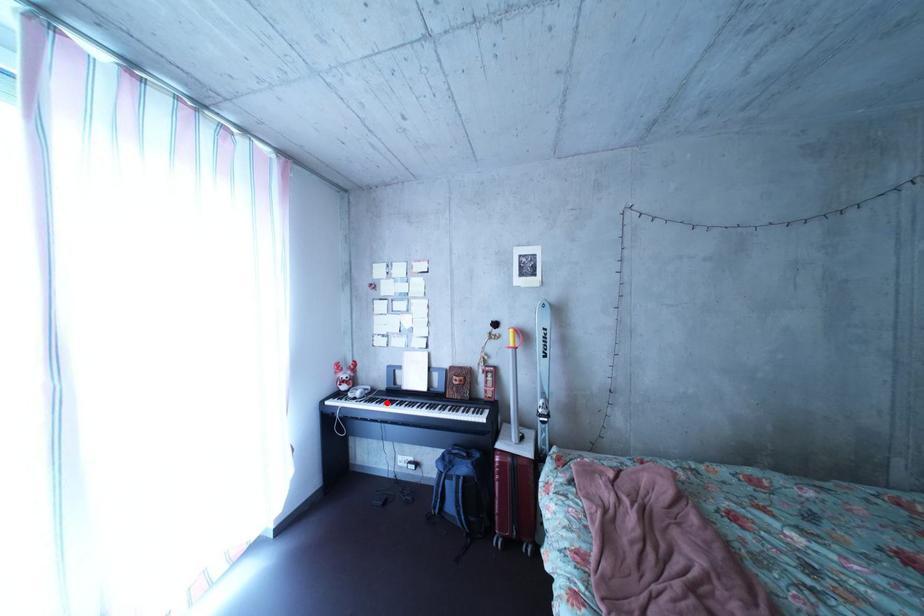
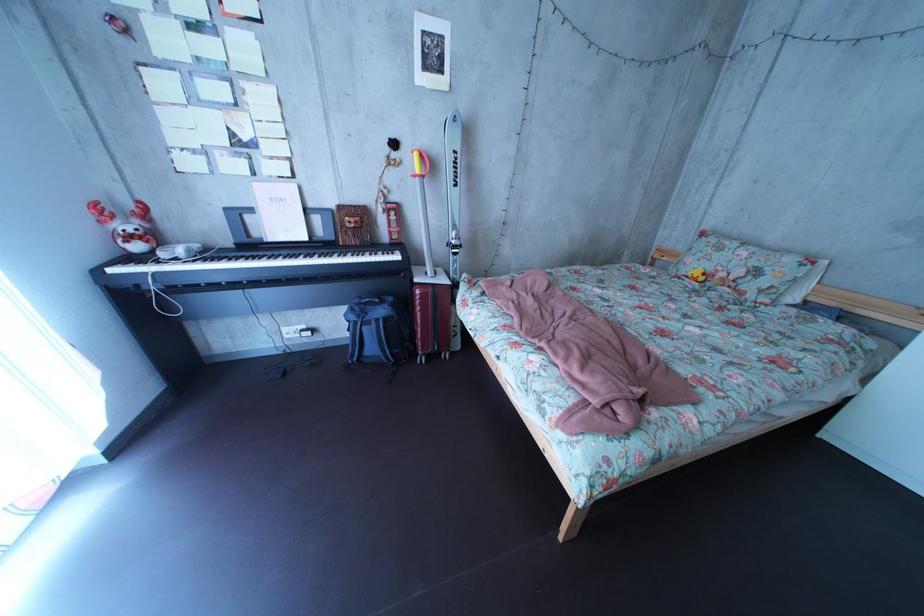
Question: I am providing you with two images of the same scene from different viewpoints. A red point is marked on the first image. Is the red point's position out of view in image 2?

Choices:
 (A) Yes
 (B) No

Answer: (B)